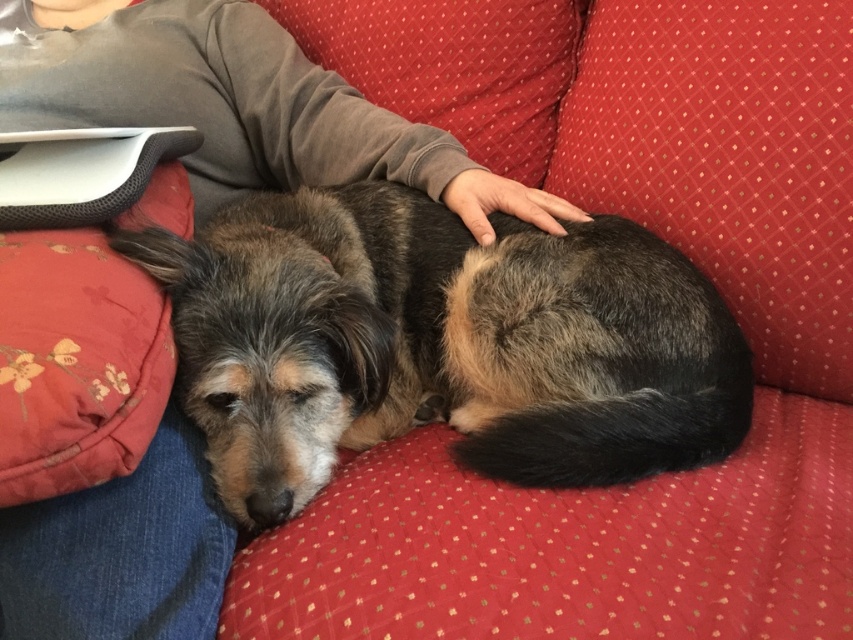
You are standing in the living room and want to place a small plant pot exactly 1 meter away from where you are standing. There is a point marked at coordinates point (61, 120) in the scene. Can you use this point as the location to place the plant pot?

The distance between point (61, 120) and the viewer is 1.08 meters, which is slightly more than 1 meter. Therefore, placing the plant pot at point (61, 120) would result in it being approximately 8 centimeters farther away than desired.

You are a furniture designer analyzing the image. You need to determine if the brown fur dog at center can be placed under a table that is designed to accommodate objects up to the height of the gray fleece sweater at upper left. Can the dog fit under the table?

The brown fur dog at center has a greater height compared to the gray fleece sweater at upper left. Therefore, the dog cannot fit under the table designed for the sweater height.